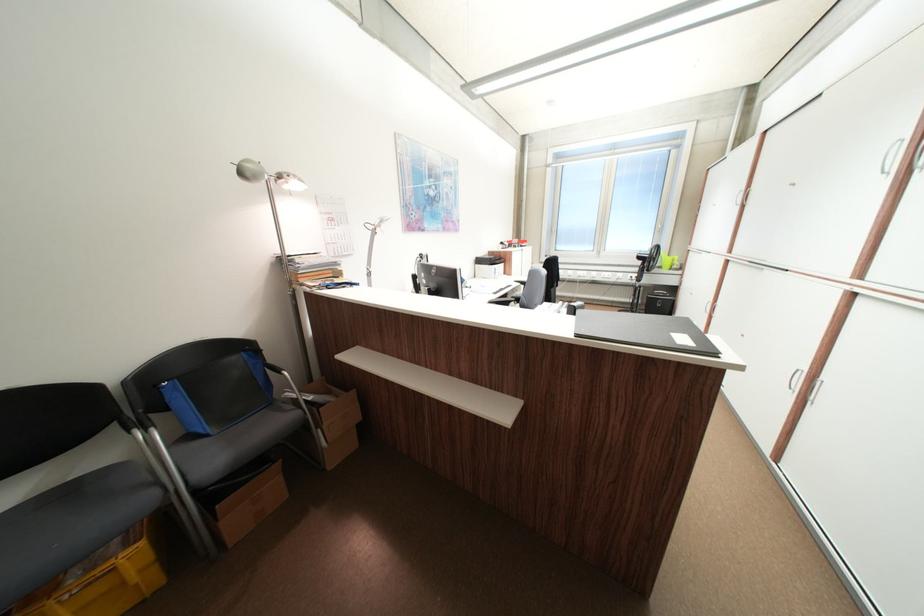
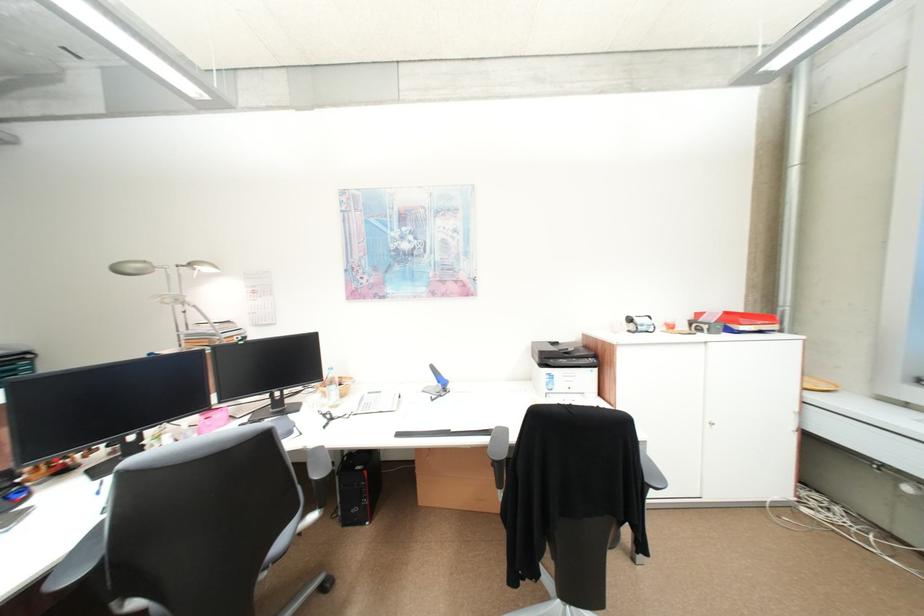
Locate, in the second image, the point that corresponds to pixel 250 172 in the first image.

(127, 272)